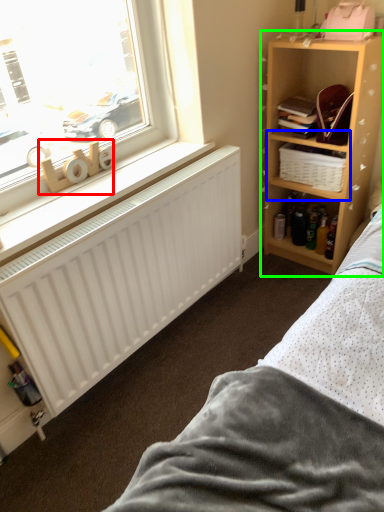
Question: Which is farther away from toy (highlighted by a red box)? cabinet (highlighted by a blue box) or shelf (highlighted by a green box)?

Choices:
 (A) cabinet
 (B) shelf

Answer: (B)